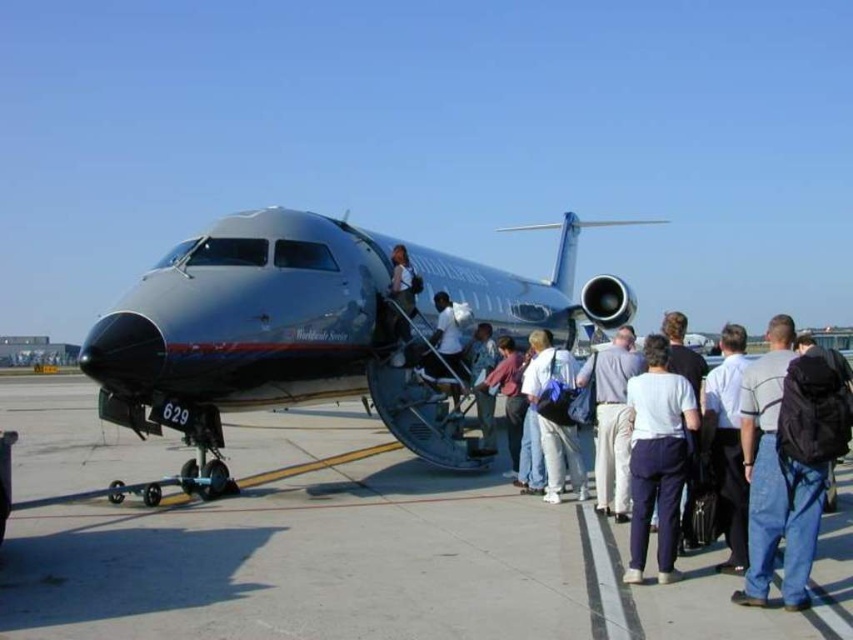
You are a passenger at the airport and need to board the aircraft. You notice two people near the boarding staircase. One is wearing denim jeans at right and the other is wearing white cotton shirt at right. Which of these two has a narrower clothing item in terms of width?

The denim jeans at right has a lesser width compared to the white cotton shirt at right, so the person wearing denim jeans at right has a narrower clothing item in terms of width.

You are a passenger at the airport and want to board the metallic gray airplane at center. The boarding gate is located at point (263, 336). Can you determine the direction you should walk to reach the boarding gate?

The metallic gray airplane at center is represented by point (263, 336). Therefore, you should walk towards the center of the scene to reach the boarding gate.